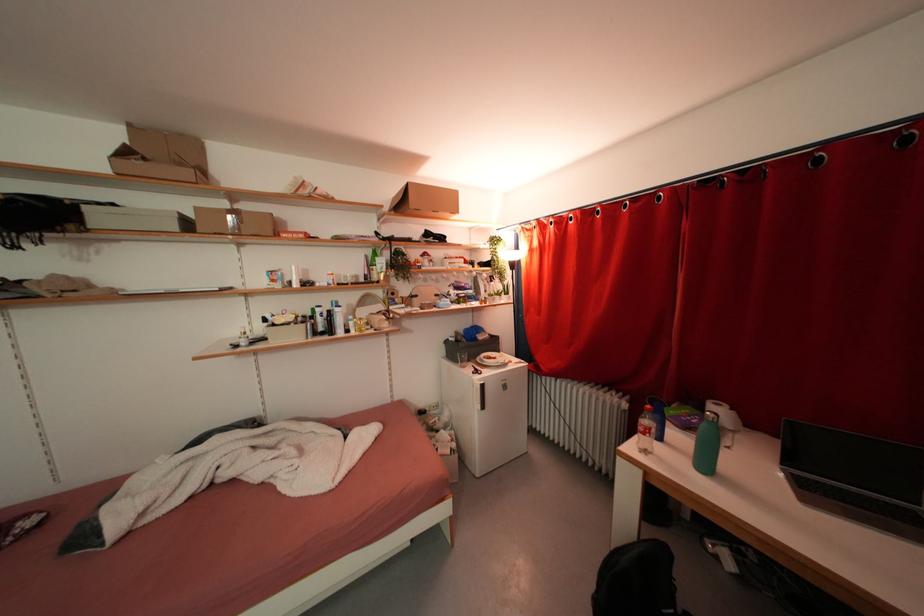
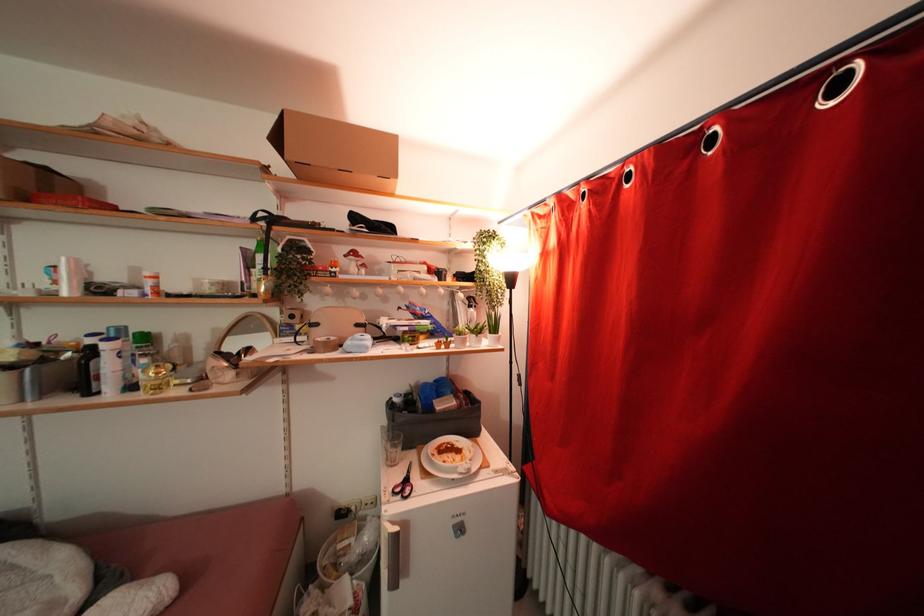
Where in the second image is the point corresponding to (x=496, y=282) from the first image?

(477, 305)